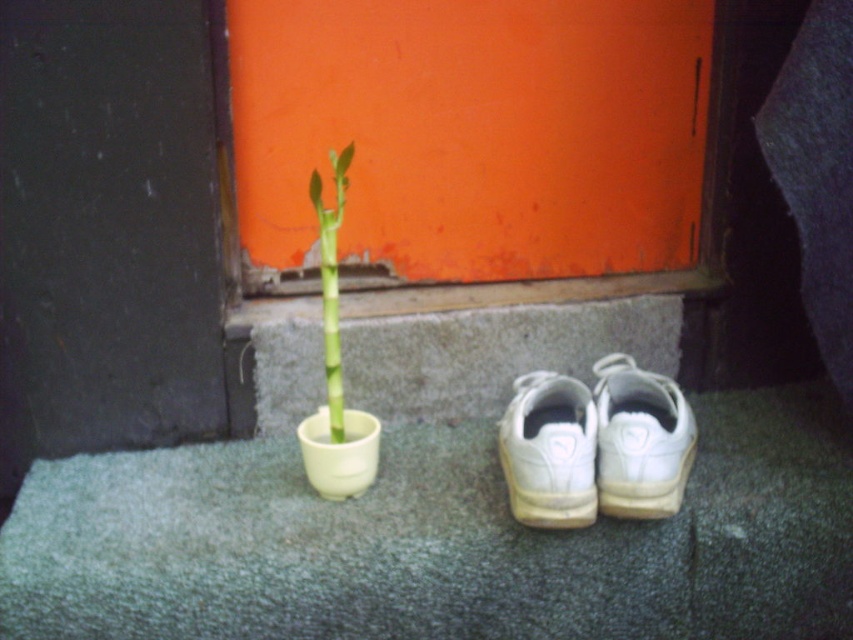
You are standing in the room and want to pick up the white leather shoe at center. According to the coordinates given, where should you look to find it?

The white leather shoe at center is located at coordinates point (x=640, y=440).

You are standing in the room and want to reach the point marked at coordinates (614, 353). The potted plant and white sneakers are in your way. Which object is closer to you, the potted plant or the white sneakers?

The point marked at coordinates (614, 353) is 4.33 feet away from the viewer. Since the potted plant and white sneakers are in the way, the object closer to you would be whichever is nearer to your position. However, the provided information only specifies the distance of the point from the viewer, not the distances of the potted plant and white sneakers. Therefore, it is impossible to determine which object is closer based on the given data.